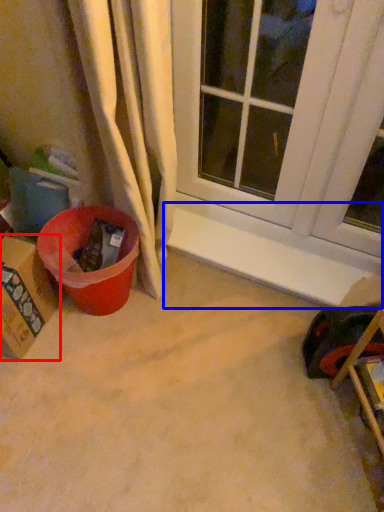
Question: Which point is further to the camera, cardboard box (highlighted by a red box) or window sill (highlighted by a blue box)?

Choices:
 (A) cardboard box
 (B) window sill

Answer: (B)